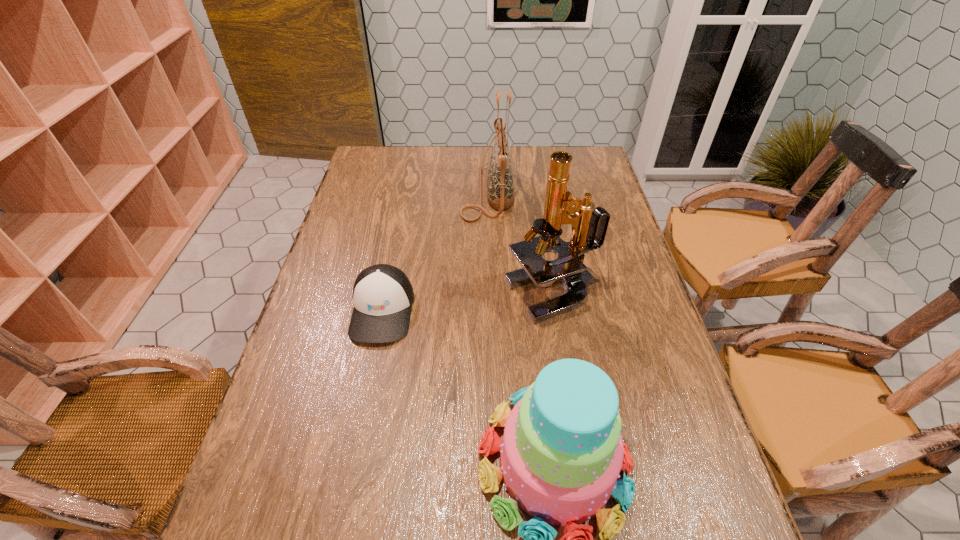
The image size is (960, 540). What are the coordinates of `the tallest object` in the screenshot? It's located at (568, 269).

Where is `handbag`? Image resolution: width=960 pixels, height=540 pixels. handbag is located at coordinates (500, 194).

You are a GUI agent. You are given a task and a screenshot of the screen. Output one action in this format:
    pyautogui.click(x=<x>, y=<y>)
    Task: Click on the third shortest object
    
    Given the screenshot: What is the action you would take?
    pyautogui.click(x=500, y=194)

At what (x,y) coordinates should I click in order to perform the action: click on the shortest object. Please return your answer as a coordinate pair (x, y). Looking at the image, I should click on (383, 296).

You are a GUI agent. You are given a task and a screenshot of the screen. Output one action in this format:
    pyautogui.click(x=<x>, y=<y>)
    Task: Click on the leftmost object
    The height and width of the screenshot is (540, 960).
    Given the screenshot: What is the action you would take?
    pyautogui.click(x=383, y=296)

Identify the location of blank area located at the eyepiece of the microscope. The height and width of the screenshot is (540, 960). (450, 294).

In order to click on blank area located 0.370m at the eyepiece of the microscope in this screenshot , I will do `click(370, 294)`.

The height and width of the screenshot is (540, 960). I want to click on vacant region located 0.180m at the eyepiece of the microscope, so click(440, 294).

Locate an element on the screen. The width and height of the screenshot is (960, 540). vacant space situated 0.340m on the front-facing side of the farthest object is located at coordinates (365, 191).

I want to click on vacant point located 0.120m on the front-facing side of the farthest object, so click(x=427, y=191).